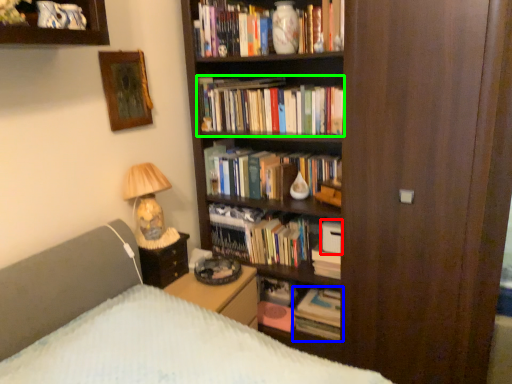
Question: Estimate the real-world distances between objects in this image. Which object is closer to paperback book (highlighted by a red box), book (highlighted by a blue box) or book (highlighted by a green box)?

Choices:
 (A) book
 (B) book

Answer: (A)